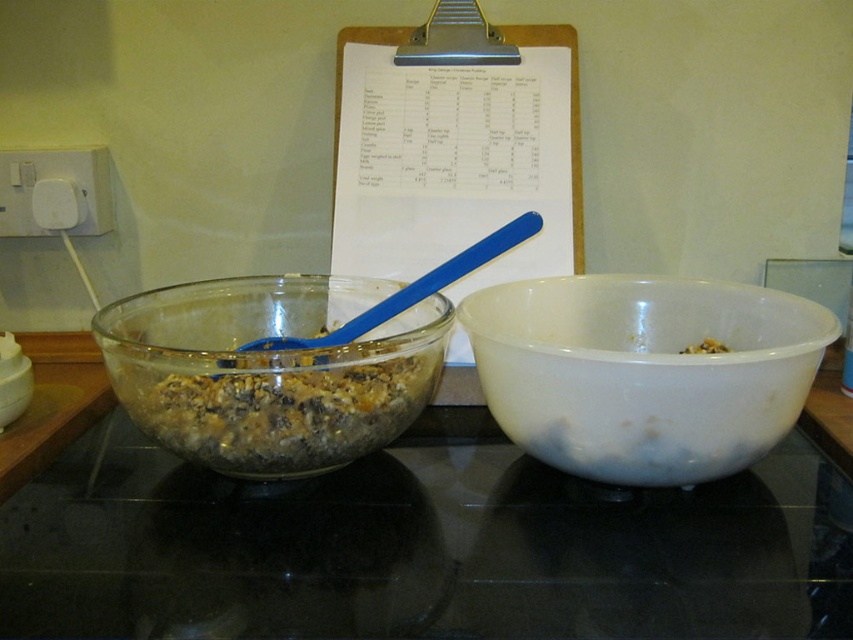
Between transparent glass bowls at center and white matte bowl at right, which one has less height?

With less height is white matte bowl at right.

Between transparent glass bowls at center and white matte bowl at right, which one has more height?

Standing taller between the two is transparent glass bowls at center.

Describe the element at coordinates (421, 547) in the screenshot. I see `transparent glass bowls at center` at that location.

I want to click on transparent glass bowls at center, so click(x=421, y=547).

Can you confirm if transparent glass bowls at center is shorter than translucent glass bowl at left?

Yes, transparent glass bowls at center is shorter than translucent glass bowl at left.

Can you confirm if transparent glass bowls at center is smaller than translucent glass bowl at left?

Incorrect, transparent glass bowls at center is not smaller in size than translucent glass bowl at left.

Is point (848, 632) farther from viewer compared to point (325, 298)?

No, it is not.

The width and height of the screenshot is (853, 640). I want to click on transparent glass bowls at center, so click(421, 547).

Who is shorter, translucent glass bowl at left or white matte bowl at right?

white matte bowl at right

Is point (445, 344) in front of point (701, 346)?

Yes, point (445, 344) is closer to viewer.

Image resolution: width=853 pixels, height=640 pixels. I want to click on translucent glass bowl at left, so click(x=270, y=371).